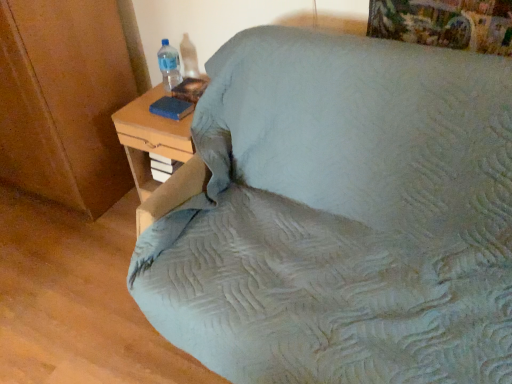
Find the location of a particular element. empty space that is ontop of woodennightstand at right (from a real-world perspective) is located at coordinates (156, 112).